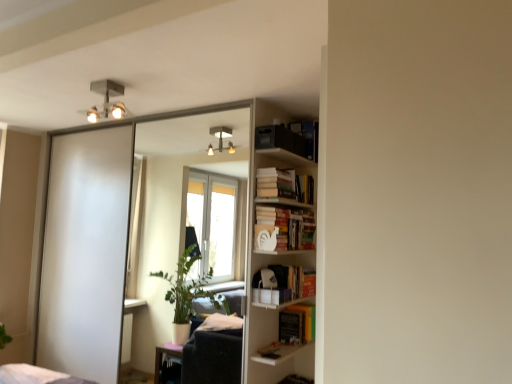
The height and width of the screenshot is (384, 512). In order to click on clear glass mirror at upper center in this screenshot , I will do `click(177, 184)`.

What is the approximate width of white matte bookshelf at right?

white matte bookshelf at right is 7.85 inches wide.

Image resolution: width=512 pixels, height=384 pixels. Identify the location of yellow matte book at center, which ranks as the 1th book in bottom-to-top order. (297, 323).

What do you see at coordinates (297, 323) in the screenshot? I see `yellow matte book at center, which ranks as the 1th book in bottom-to-top order` at bounding box center [297, 323].

Where is `clear glass mirror at upper center`? clear glass mirror at upper center is located at coordinates (177, 184).

Consider the image. Is metallic square light fixture at upper center positioned with its back to yellow matte book at center, which is the 4th book from top to bottom?

metallic square light fixture at upper center does not have its back to yellow matte book at center, which is the 4th book from top to bottom.

Which of these two, metallic square light fixture at upper center or yellow matte book at center, which ranks as the 1th book in bottom-to-top order, stands taller?

Standing taller between the two is yellow matte book at center, which ranks as the 1th book in bottom-to-top order.

Relative to yellow matte book at center, which ranks as the 1th book in bottom-to-top order, is metallic square light fixture at upper center in front or behind?

metallic square light fixture at upper center is positioned closer to the viewer than yellow matte book at center, which ranks as the 1th book in bottom-to-top order.

Is hardcover books at upper center, acting as the third book starting from the bottom, next to metallic square light fixture at upper center?

hardcover books at upper center, acting as the third book starting from the bottom, and metallic square light fixture at upper center are clearly separated.

Could you measure the distance between hardcover books at upper center, acting as the 2th book starting from the top, and metallic square light fixture at upper center?

hardcover books at upper center, acting as the 2th book starting from the top, is 1.24 meters from metallic square light fixture at upper center.

From a real-world perspective, is hardcover books at upper center, acting as the third book starting from the bottom, positioned under metallic square light fixture at upper center based on gravity?

Yes, from a real-world perspective, hardcover books at upper center, acting as the third book starting from the bottom, is below metallic square light fixture at upper center.

Is clear glass mirror at upper center beside white matte bookshelf at right?

clear glass mirror at upper center is not next to white matte bookshelf at right, and they're not touching.

Which of these two, clear glass mirror at upper center or white matte bookshelf at right, is thinner?

clear glass mirror at upper center is thinner.

Considering the positions of point (179, 234) and point (310, 243), is point (179, 234) closer or farther from the camera than point (310, 243)?

Point (179, 234) appears to be farther away from the viewer than point (310, 243).

Considering the sizes of objects yellow matte book at center, which ranks as the 1th book in bottom-to-top order, and white matte bookshelf at center-right, acting as the third book starting from the top, in the image provided, who is bigger, yellow matte book at center, which ranks as the 1th book in bottom-to-top order, or white matte bookshelf at center-right, acting as the third book starting from the top,?

Bigger between the two is white matte bookshelf at center-right, acting as the third book starting from the top.

Is yellow matte book at center, which ranks as the 1th book in bottom-to-top order, not inside white matte bookshelf at center-right, placed as the second book when sorted from bottom to top?

Yes, yellow matte book at center, which ranks as the 1th book in bottom-to-top order, is located beyond the bounds of white matte bookshelf at center-right, placed as the second book when sorted from bottom to top.

How different are the orientations of yellow matte book at center, which ranks as the 1th book in bottom-to-top order, and white matte bookshelf at center-right, placed as the second book when sorted from bottom to top, in degrees?

The facing directions of yellow matte book at center, which ranks as the 1th book in bottom-to-top order, and white matte bookshelf at center-right, placed as the second book when sorted from bottom to top, are 0.000519 degrees apart.

From a real-world perspective, count 1st books upward from the yellow matte book at center, which is the 4th book from top to bottom, and point to it. Please provide its 2D coordinates.

[(284, 228)]

Does yellow matte book at center, which ranks as the 1th book in bottom-to-top order, have a lesser width compared to hardcover books at upper center, acting as the third book starting from the bottom?

No.

Would you say yellow matte book at center, which ranks as the 1th book in bottom-to-top order, is to the left or to the right of hardcover books at upper center, acting as the 2th book starting from the top, in the picture?

yellow matte book at center, which ranks as the 1th book in bottom-to-top order, is to the right of hardcover books at upper center, acting as the 2th book starting from the top.

Considering the relative sizes of yellow matte book at center, which is the 4th book from top to bottom, and hardcover books at upper center, acting as the third book starting from the bottom, in the image provided, is yellow matte book at center, which is the 4th book from top to bottom, shorter than hardcover books at upper center, acting as the third book starting from the bottom,?

Incorrect, the height of yellow matte book at center, which is the 4th book from top to bottom, does not fall short of that of hardcover books at upper center, acting as the third book starting from the bottom.

From a real-world perspective, which is physically above, yellow matte book at center, which ranks as the 1th book in bottom-to-top order, or hardcover books at upper center, acting as the 2th book starting from the top?

From a 3D spatial view, hardcover books at upper center, acting as the 2th book starting from the top, is above.

Based on their sizes in the image, would you say matte black bookshelf at upper right, which is counted as the 4th book, starting from the bottom, is bigger or smaller than metallic square light fixture at upper center?

matte black bookshelf at upper right, which is counted as the 4th book, starting from the bottom, is bigger than metallic square light fixture at upper center.

From the image's perspective, is matte black bookshelf at upper right, which is counted as the 4th book, starting from the bottom, beneath metallic square light fixture at upper center?

Yes.

Considering the sizes of objects matte black bookshelf at upper right, which ranks as the 1th book in top-to-bottom order, and metallic square light fixture at upper center in the image provided, who is wider, matte black bookshelf at upper right, which ranks as the 1th book in top-to-bottom order, or metallic square light fixture at upper center?

Wider between the two is metallic square light fixture at upper center.

From the image's perspective, which is below, white matte bookshelf at center-right, placed as the second book when sorted from bottom to top, or hardcover books at upper center, acting as the 2th book starting from the top?

From the image's view, white matte bookshelf at center-right, placed as the second book when sorted from bottom to top, is below.

Is white matte bookshelf at center-right, acting as the third book starting from the top, positioned with its back to hardcover books at upper center, acting as the third book starting from the bottom?

No.

Is point (279, 245) positioned in front of point (266, 173)?

No, (279, 245) is behind (266, 173).

Between white matte bookshelf at center-right, placed as the second book when sorted from bottom to top, and hardcover books at upper center, acting as the 2th book starting from the top, which one has more height?

white matte bookshelf at center-right, placed as the second book when sorted from bottom to top, is taller.

Identify the location of light fixture positioned vertically above the yellow matte book at center, which is the 4th book from top to bottom (from a real-world perspective). The height and width of the screenshot is (384, 512). (106, 100).

Identify the location of light fixture on the left of hardcover books at upper center, acting as the 2th book starting from the top. (106, 100).

Based on their spatial positions, is matte black bookshelf at upper right, which is counted as the 4th book, starting from the bottom, or yellow matte book at center, which is the 4th book from top to bottom, closer to white matte bookshelf at right?

yellow matte book at center, which is the 4th book from top to bottom, is closer to white matte bookshelf at right.

Considering their positions, is yellow matte book at center, which ranks as the 1th book in bottom-to-top order, positioned closer to matte black bookshelf at upper right, which is counted as the 4th book, starting from the bottom, than white matte bookshelf at right?

white matte bookshelf at right is closer to matte black bookshelf at upper right, which is counted as the 4th book, starting from the bottom.

Estimate the real-world distances between objects in this image. Which object is closer to metallic square light fixture at upper center, hardcover books at upper center, acting as the 2th book starting from the top, or white matte bookshelf at center-right, placed as the second book when sorted from bottom to top?

hardcover books at upper center, acting as the 2th book starting from the top, is positioned closer to the anchor metallic square light fixture at upper center.

Estimate the real-world distances between objects in this image. Which object is further from white matte bookshelf at center-right, placed as the second book when sorted from bottom to top, matte black bookshelf at upper right, which is counted as the 4th book, starting from the bottom, or clear glass mirror at upper center?

Based on the image, clear glass mirror at upper center appears to be further to white matte bookshelf at center-right, placed as the second book when sorted from bottom to top.

When comparing their distances from matte black bookshelf at upper right, which ranks as the 1th book in top-to-bottom order, does white matte bookshelf at right or yellow matte book at center, which ranks as the 1th book in bottom-to-top order, seem closer?

Among the two, white matte bookshelf at right is located nearer to matte black bookshelf at upper right, which ranks as the 1th book in top-to-bottom order.

Based on their spatial positions, is matte black bookshelf at upper right, which is counted as the 4th book, starting from the bottom, or hardcover books at upper center, acting as the 2th book starting from the top, further from clear glass mirror at upper center?

Based on the image, hardcover books at upper center, acting as the 2th book starting from the top, appears to be further to clear glass mirror at upper center.

Looking at the image, which one is located further to metallic square light fixture at upper center, matte black bookshelf at upper right, which is counted as the 4th book, starting from the bottom, or white matte bookshelf at right?

white matte bookshelf at right is positioned further to the anchor metallic square light fixture at upper center.

Considering their positions, is yellow matte book at center, which ranks as the 1th book in bottom-to-top order, positioned closer to hardcover books at upper center, acting as the 2th book starting from the top, than clear glass mirror at upper center?

yellow matte book at center, which ranks as the 1th book in bottom-to-top order.

The width and height of the screenshot is (512, 384). I want to click on shelf between clear glass mirror at upper center and white matte bookshelf at center-right, placed as the second book when sorted from bottom to top, from left to right, so click(x=274, y=259).

Locate an element on the screen. The height and width of the screenshot is (384, 512). shelf between clear glass mirror at upper center and yellow matte book at center, which is the 4th book from top to bottom, from left to right is located at coordinates (274, 259).

I want to click on shelf located between clear glass mirror at upper center and hardcover books at upper center, acting as the third book starting from the bottom, in the left-right direction, so click(274, 259).

I want to click on book between metallic square light fixture at upper center and white matte bookshelf at right, so click(290, 138).